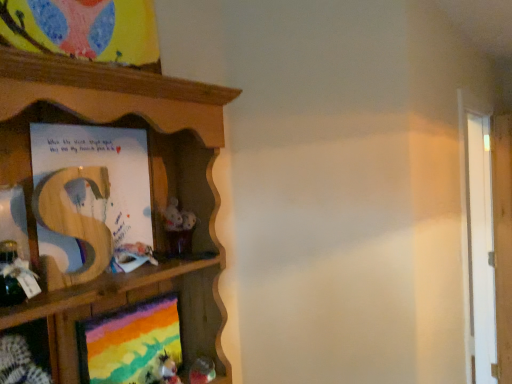
What do you see at coordinates (131, 344) in the screenshot?
I see `multicolored felt picture frame at lower left` at bounding box center [131, 344].

Identify the location of multicolored felt picture frame at lower left. The width and height of the screenshot is (512, 384). (131, 344).

The height and width of the screenshot is (384, 512). What are the coordinates of `multicolored felt picture frame at lower left` in the screenshot? It's located at (131, 344).